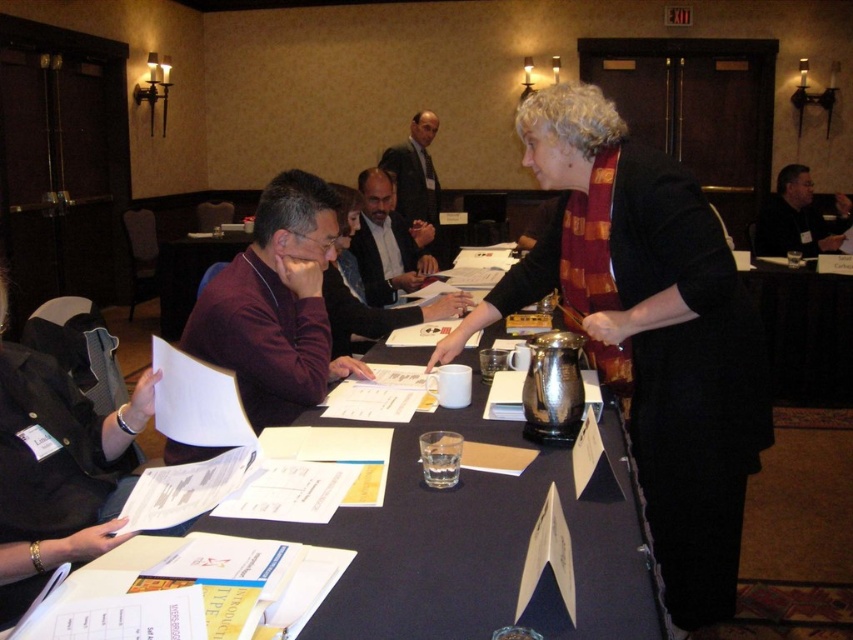
Can you confirm if maroon scarf at center is thinner than dark brown leather jacket at center?

In fact, maroon scarf at center might be wider than dark brown leather jacket at center.

Does maroon scarf at center have a greater width compared to dark brown leather jacket at center?

Correct, the width of maroon scarf at center exceeds that of dark brown leather jacket at center.

What do you see at coordinates (648, 332) in the screenshot? Image resolution: width=853 pixels, height=640 pixels. I see `maroon scarf at center` at bounding box center [648, 332].

Find the location of a particular element. The image size is (853, 640). maroon scarf at center is located at coordinates (648, 332).

Can you confirm if maroon scarf at center is positioned to the right of metallic silver pitcher at center?

Yes, maroon scarf at center is to the right of metallic silver pitcher at center.

Between point (677, 566) and point (494, 556), which one is positioned behind?

The point (677, 566) is behind.

The image size is (853, 640). In order to click on maroon scarf at center in this screenshot , I will do `click(648, 332)`.

The height and width of the screenshot is (640, 853). I want to click on maroon scarf at center, so click(648, 332).

Between dark brown leather jacket at center and dark suit jacket at center, which one has more height?

dark suit jacket at center is taller.

Which is above, dark brown leather jacket at center or dark suit jacket at center?

dark suit jacket at center

What do you see at coordinates (387, 243) in the screenshot?
I see `dark brown leather jacket at center` at bounding box center [387, 243].

Identify the location of dark brown leather jacket at center. (387, 243).